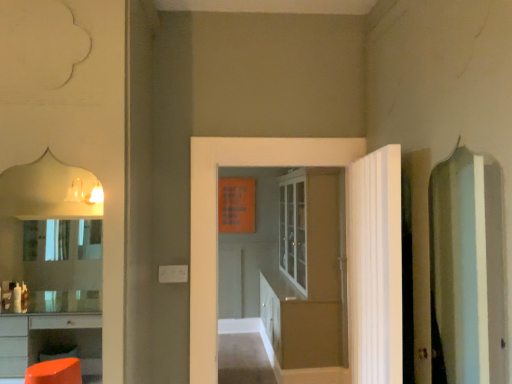
Find the location of a particular element. white textured door at right, positioned as the third door in back-to-front order is located at coordinates coord(374,267).

Locate an element on the screen. The image size is (512, 384). white glossy door at center, acting as the second door starting from the front is located at coordinates (217, 218).

In order to face white glossy door at center, acting as the second door starting from the front, should I rotate leftwards or rightwards?

Rotate right and turn 3.879 degrees.

Find the location of a particular element. white textured door at right, positioned as the third door in back-to-front order is located at coordinates (374, 267).

Do you think white glossy door at center, acting as the second door starting from the front, is within matte glass cabinet at center, which is the 3th door from front to back, or outside of it?

white glossy door at center, acting as the second door starting from the front, is not inside matte glass cabinet at center, which is the 3th door from front to back, it's outside.

Is white glossy door at center, which is the 2th door in back-to-front order, oriented away from matte glass cabinet at center, which is the 3th door from front to back?

Yes.

Does white glossy door at center, acting as the second door starting from the front, come behind matte glass cabinet at center, which is the 3th door from front to back?

No.

Is there a large distance between white textured door at right, placed as the first door when sorted from front to back, and white glossy door at center, which is the 2th door in back-to-front order?

No.

Would you say white textured door at right, positioned as the third door in back-to-front order, is to the left or to the right of white glossy door at center, acting as the second door starting from the front, in the picture?

white textured door at right, positioned as the third door in back-to-front order, is to the right of white glossy door at center, acting as the second door starting from the front.

Do you think white textured door at right, positioned as the third door in back-to-front order, is within white glossy door at center, which is the 2th door in back-to-front order, or outside of it?

white textured door at right, positioned as the third door in back-to-front order, exists outside the volume of white glossy door at center, which is the 2th door in back-to-front order.

Considering the points (364, 339) and (316, 165), which point is behind, point (364, 339) or point (316, 165)?

The point (316, 165) is more distant.

Starting from the white textured door at right, placed as the first door when sorted from front to back, which door is the 2nd one behind? Please provide its 2D coordinates.

[(307, 273)]

Considering the sizes of objects matte glass cabinet at center, which is the 3th door from front to back, and white textured door at right, placed as the first door when sorted from front to back, in the image provided, who is wider, matte glass cabinet at center, which is the 3th door from front to back, or white textured door at right, placed as the first door when sorted from front to back,?

matte glass cabinet at center, which is the 3th door from front to back.

In the scene shown: How distant is matte glass cabinet at center, which is the 3th door from front to back, from white textured door at right, positioned as the third door in back-to-front order?

matte glass cabinet at center, which is the 3th door from front to back, and white textured door at right, positioned as the third door in back-to-front order, are 2.17 meters apart from each other.

Considering the sizes of objects matte glass cabinet at center, which is the 3th door from front to back, and white textured door at right, positioned as the third door in back-to-front order, in the image provided, who is taller, matte glass cabinet at center, which is the 3th door from front to back, or white textured door at right, positioned as the third door in back-to-front order,?

Standing taller between the two is matte glass cabinet at center, which is the 3th door from front to back.

Can you confirm if white textured door at right, positioned as the third door in back-to-front order, is positioned to the right of matte glass cabinet at center, which is counted as the 1th door, starting from the back?

Correct, you'll find white textured door at right, positioned as the third door in back-to-front order, to the right of matte glass cabinet at center, which is counted as the 1th door, starting from the back.

Which door is the 1st one when counting from the left side of the white textured door at right, placed as the first door when sorted from front to back? Please provide its 2D coordinates.

[(307, 273)]

Does white textured door at right, positioned as the third door in back-to-front order, have a smaller size compared to matte glass cabinet at center, which is counted as the 1th door, starting from the back?

Correct, white textured door at right, positioned as the third door in back-to-front order, occupies less space than matte glass cabinet at center, which is counted as the 1th door, starting from the back.

Between white textured door at right, placed as the first door when sorted from front to back, and matte glass cabinet at center, which is the 3th door from front to back, which one has less height?

white textured door at right, placed as the first door when sorted from front to back.

Is white glossy door at center, which is the 2th door in back-to-front order, spatially inside white textured door at right, placed as the first door when sorted from front to back, or outside of it?

white glossy door at center, which is the 2th door in back-to-front order, is spatially situated outside white textured door at right, placed as the first door when sorted from front to back.

Does white glossy door at center, which is the 2th door in back-to-front order, appear on the left side of white textured door at right, positioned as the third door in back-to-front order?

Yes, white glossy door at center, which is the 2th door in back-to-front order, is to the left of white textured door at right, positioned as the third door in back-to-front order.

Can you see white glossy door at center, acting as the second door starting from the front, touching white textured door at right, placed as the first door when sorted from front to back?

No, white glossy door at center, acting as the second door starting from the front, is not next to white textured door at right, placed as the first door when sorted from front to back.

From the image's perspective, which is below, white glossy door at center, which is the 2th door in back-to-front order, or white textured door at right, placed as the first door when sorted from front to back?

white textured door at right, placed as the first door when sorted from front to back.

From the image's perspective, which object appears higher, matte glass cabinet at center, which is counted as the 1th door, starting from the back, or white glossy door at center, which is the 2th door in back-to-front order?

white glossy door at center, which is the 2th door in back-to-front order, appears higher in the image.

Is matte glass cabinet at center, which is counted as the 1th door, starting from the back, beside white glossy door at center, acting as the second door starting from the front?

No, matte glass cabinet at center, which is counted as the 1th door, starting from the back, is not touching white glossy door at center, acting as the second door starting from the front.

Is matte glass cabinet at center, which is counted as the 1th door, starting from the back, completely or partially outside of white glossy door at center, which is the 2th door in back-to-front order?

That's correct, matte glass cabinet at center, which is counted as the 1th door, starting from the back, is outside of white glossy door at center, which is the 2th door in back-to-front order.

Is matte glass cabinet at center, which is counted as the 1th door, starting from the back, positioned before white glossy door at center, acting as the second door starting from the front?

No.

Where is `door behind the white glossy door at center, which is the 2th door in back-to-front order`? This screenshot has width=512, height=384. door behind the white glossy door at center, which is the 2th door in back-to-front order is located at coordinates (307, 273).

At what (x,y) coordinates should I click in order to perform the action: click on door in front of the white glossy door at center, acting as the second door starting from the front. Please return your answer as a coordinate pair (x, y). The width and height of the screenshot is (512, 384). Looking at the image, I should click on (374, 267).

Based on their spatial positions, is matte glass cabinet at center, which is the 3th door from front to back, or white glossy door at center, acting as the second door starting from the front, further from white textured door at right, positioned as the third door in back-to-front order?

matte glass cabinet at center, which is the 3th door from front to back.

Looking at the image, which one is located further to white glossy door at center, which is the 2th door in back-to-front order, matte glass cabinet at center, which is counted as the 1th door, starting from the back, or white textured door at right, positioned as the third door in back-to-front order?

matte glass cabinet at center, which is counted as the 1th door, starting from the back, is further to white glossy door at center, which is the 2th door in back-to-front order.

Considering their positions, is white textured door at right, placed as the first door when sorted from front to back, positioned further to matte glass cabinet at center, which is the 3th door from front to back, than white glossy door at center, acting as the second door starting from the front?

Among the two, white glossy door at center, acting as the second door starting from the front, is located further to matte glass cabinet at center, which is the 3th door from front to back.

From the image, which object appears to be nearer to white glossy door at center, acting as the second door starting from the front, white textured door at right, positioned as the third door in back-to-front order, or matte glass cabinet at center, which is counted as the 1th door, starting from the back?

Among the two, white textured door at right, positioned as the third door in back-to-front order, is located nearer to white glossy door at center, acting as the second door starting from the front.

When comparing their distances from white textured door at right, placed as the first door when sorted from front to back, does white glossy door at center, acting as the second door starting from the front, or matte glass cabinet at center, which is counted as the 1th door, starting from the back, seem closer?

white glossy door at center, acting as the second door starting from the front.

Which object lies nearer to the anchor point matte glass cabinet at center, which is counted as the 1th door, starting from the back, white glossy door at center, which is the 2th door in back-to-front order, or white textured door at right, placed as the first door when sorted from front to back?

white textured door at right, placed as the first door when sorted from front to back, is closer to matte glass cabinet at center, which is counted as the 1th door, starting from the back.

The height and width of the screenshot is (384, 512). I want to click on door between white textured door at right, positioned as the third door in back-to-front order, and matte glass cabinet at center, which is counted as the 1th door, starting from the back, from front to back, so click(217, 218).